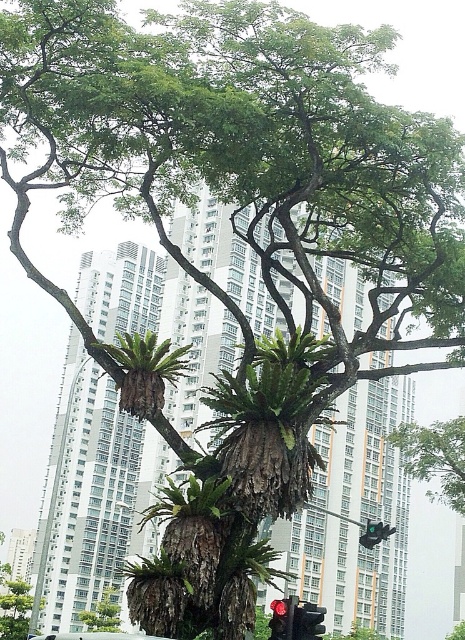
Question: Observing the image, what is the correct spatial positioning of brown textured fern at center in reference to green matte traffic light at center?

Choices:
 (A) below
 (B) above

Answer: (B)

Question: Which point appears farthest from the camera in this image?

Choices:
 (A) (117, 634)
 (B) (101, 604)
 (C) (166, 356)

Answer: (B)

Question: Which of the following is the closest to the observer?

Choices:
 (A) brown textured fern at center
 (B) green rough bark tree at lower left
 (C) white matte car at lower center
 (D) red glass traffic light at center

Answer: (C)

Question: Which is farther from the brown textured fern at center?

Choices:
 (A) green rough textured fern at center
 (B) green leafy tree at center

Answer: (B)

Question: From the image, what is the correct spatial relationship of green rough bark tree at center in relation to green rough bark tree at lower left?

Choices:
 (A) above
 (B) below

Answer: (A)

Question: Does brown textured fern at center appear under red glass traffic light at center?

Choices:
 (A) no
 (B) yes

Answer: (A)